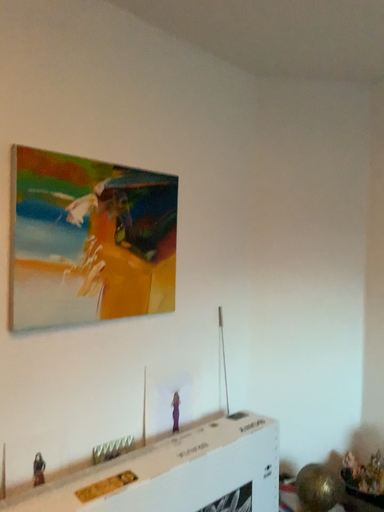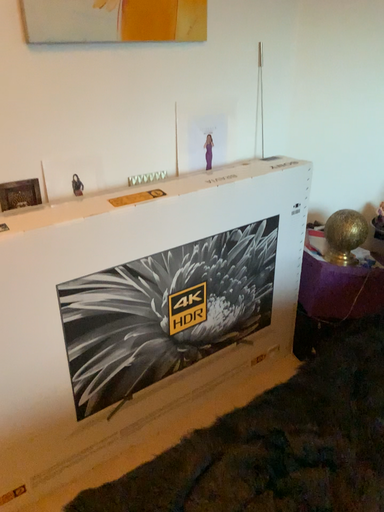
Question: Which way did the camera rotate in the video?

Choices:
 (A) rotated right
 (B) rotated left

Answer: (B)